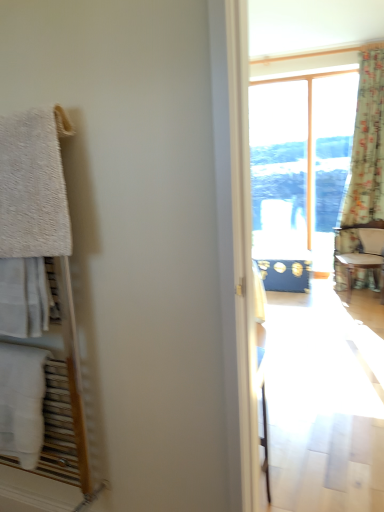
This screenshot has width=384, height=512. What do you see at coordinates (33, 185) in the screenshot?
I see `white fluffy towel at left, placed as the 2th towel/napkin when sorted from bottom to top` at bounding box center [33, 185].

Image resolution: width=384 pixels, height=512 pixels. What do you see at coordinates (353, 253) in the screenshot?
I see `wooden textured chair at right` at bounding box center [353, 253].

You are a GUI agent. You are given a task and a screenshot of the screen. Output one action in this format:
    pyautogui.click(x=<x>, y=<y>)
    Task: Click on the white cotton towel at left, the first towel/napkin when ordered from bottom to top
    The height and width of the screenshot is (512, 384).
    Given the screenshot: What is the action you would take?
    pyautogui.click(x=22, y=402)

Identify the location of white fluffy towel at left, placed as the first towel/napkin when sorted from top to bottom. The width and height of the screenshot is (384, 512). (33, 185).

Where is `curtain behind the white fluffy towel at left, placed as the first towel/napkin when sorted from top to bottom`? This screenshot has width=384, height=512. curtain behind the white fluffy towel at left, placed as the first towel/napkin when sorted from top to bottom is located at coordinates (367, 147).

Is point (364, 166) positioned before point (33, 144)?

No, it is not.

From a real-world perspective, which is physically above, floral fabric curtain at right or white fluffy towel at left, placed as the 2th towel/napkin when sorted from bottom to top?

Answer: From a 3D spatial view, white fluffy towel at left, placed as the 2th towel/napkin when sorted from bottom to top, is above.

Looking at this image, does floral fabric curtain at right have a larger size compared to white fluffy towel at left, placed as the first towel/napkin when sorted from top to bottom?

Yes, floral fabric curtain at right is bigger than white fluffy towel at left, placed as the first towel/napkin when sorted from top to bottom.

From a real-world perspective, is white fluffy towel at left, placed as the first towel/napkin when sorted from top to bottom, physically above white cotton towel at left, the second towel/napkin when ordered from top to bottom?

Yes, from a real-world perspective, white fluffy towel at left, placed as the first towel/napkin when sorted from top to bottom, is over white cotton towel at left, the second towel/napkin when ordered from top to bottom

The width and height of the screenshot is (384, 512). I want to click on towel/napkin located on the right of white cotton towel at left, the second towel/napkin when ordered from top to bottom, so click(33, 185).

What's the angular difference between white fluffy towel at left, placed as the first towel/napkin when sorted from top to bottom, and white cotton towel at left, the first towel/napkin when ordered from bottom to top,'s facing directions?

They differ by 0.000374 degrees in their facing directions.

From the image's perspective, relative to white cotton towel at left, the first towel/napkin when ordered from bottom to top, is white fluffy towel at left, placed as the first towel/napkin when sorted from top to bottom, above or below?

white fluffy towel at left, placed as the first towel/napkin when sorted from top to bottom, is situated higher than white cotton towel at left, the first towel/napkin when ordered from bottom to top, in the image.

Is point (42, 436) closer to camera compared to point (17, 173)?

No, it is not.

Does white cotton towel at left, the first towel/napkin when ordered from bottom to top, touch white fluffy towel at left, placed as the first towel/napkin when sorted from top to bottom?

No, white cotton towel at left, the first towel/napkin when ordered from bottom to top, is not in contact with white fluffy towel at left, placed as the first towel/napkin when sorted from top to bottom.

Which object is positioned more to the left, white cotton towel at left, the second towel/napkin when ordered from top to bottom, or white fluffy towel at left, placed as the 2th towel/napkin when sorted from bottom to top?

From the viewer's perspective, white cotton towel at left, the second towel/napkin when ordered from top to bottom, appears more on the left side.

Looking at this image, considering the relative sizes of white cotton towel at left, the first towel/napkin when ordered from bottom to top, and white fluffy towel at left, placed as the 2th towel/napkin when sorted from bottom to top, in the image provided, is white cotton towel at left, the first towel/napkin when ordered from bottom to top, thinner than white fluffy towel at left, placed as the 2th towel/napkin when sorted from bottom to top,?

Incorrect, the width of white cotton towel at left, the first towel/napkin when ordered from bottom to top, is not less than that of white fluffy towel at left, placed as the 2th towel/napkin when sorted from bottom to top.

Consider the image. Between white cotton towel at left, the first towel/napkin when ordered from bottom to top, and wooden textured chair at right, which one appears on the right side from the viewer's perspective?

wooden textured chair at right is more to the right.

Is white cotton towel at left, the first towel/napkin when ordered from bottom to top, inside the boundaries of wooden textured chair at right, or outside?

white cotton towel at left, the first towel/napkin when ordered from bottom to top, exists outside the volume of wooden textured chair at right.

In the scene shown: In terms of width, does white cotton towel at left, the first towel/napkin when ordered from bottom to top, look wider or thinner when compared to wooden textured chair at right?

Considering their sizes, white cotton towel at left, the first towel/napkin when ordered from bottom to top, looks slimmer than wooden textured chair at right.

Considering the relative positions of white cotton towel at left, the first towel/napkin when ordered from bottom to top, and wooden textured chair at right in the image provided, is white cotton towel at left, the first towel/napkin when ordered from bottom to top, in front of wooden textured chair at right?

Yes.

Could you tell me if white fluffy towel at left, placed as the first towel/napkin when sorted from top to bottom, is facing wooden textured chair at right?

No, white fluffy towel at left, placed as the first towel/napkin when sorted from top to bottom, is not facing towards wooden textured chair at right.

How far apart are white fluffy towel at left, placed as the first towel/napkin when sorted from top to bottom, and wooden textured chair at right?

white fluffy towel at left, placed as the first towel/napkin when sorted from top to bottom, is 3.49 meters away from wooden textured chair at right.

Does white fluffy towel at left, placed as the first towel/napkin when sorted from top to bottom, have a lesser height compared to wooden textured chair at right?

Correct, white fluffy towel at left, placed as the first towel/napkin when sorted from top to bottom, is not as tall as wooden textured chair at right.

Is white fluffy towel at left, placed as the first towel/napkin when sorted from top to bottom, beside wooden textured chair at right?

white fluffy towel at left, placed as the first towel/napkin when sorted from top to bottom, and wooden textured chair at right are clearly separated.

From a real-world perspective, which object stands above the other?

white fluffy towel at left, placed as the 2th towel/napkin when sorted from bottom to top, from a real-world perspective.

Is point (372, 228) positioned behind point (54, 181)?

Yes.

Based on the photo, from a real-world perspective, between white fluffy towel at left, placed as the 2th towel/napkin when sorted from bottom to top, and floral fabric curtain at right, who is vertically lower?

In real-world perspective, floral fabric curtain at right is lower.

Is white fluffy towel at left, placed as the first towel/napkin when sorted from top to bottom, taller than floral fabric curtain at right?

Incorrect, the height of white fluffy towel at left, placed as the first towel/napkin when sorted from top to bottom, is not larger of that of floral fabric curtain at right.

Is white fluffy towel at left, placed as the first towel/napkin when sorted from top to bottom, facing away from floral fabric curtain at right?

Yes, floral fabric curtain at right is at the back of white fluffy towel at left, placed as the first towel/napkin when sorted from top to bottom.

Can you tell me how much white fluffy towel at left, placed as the 2th towel/napkin when sorted from bottom to top, and floral fabric curtain at right differ in facing direction?

The angle between the facing direction of white fluffy towel at left, placed as the 2th towel/napkin when sorted from bottom to top, and the facing direction of floral fabric curtain at right is 3.15 degrees.

At what (x,y) coordinates should I click in order to perform the action: click on curtain on the right of the white fluffy towel at left, placed as the first towel/napkin when sorted from top to bottom. Please return your answer as a coordinate pair (x, y). Image resolution: width=384 pixels, height=512 pixels. Looking at the image, I should click on tap(367, 147).

Image resolution: width=384 pixels, height=512 pixels. Identify the location of towel/napkin behind the white fluffy towel at left, placed as the 2th towel/napkin when sorted from bottom to top. (22, 402).

Estimate the real-world distances between objects in this image. Which object is further from white fluffy towel at left, placed as the 2th towel/napkin when sorted from bottom to top, white cotton towel at left, the first towel/napkin when ordered from bottom to top, or wooden textured chair at right?

Based on the image, wooden textured chair at right appears to be further to white fluffy towel at left, placed as the 2th towel/napkin when sorted from bottom to top.

Looking at this image, estimate the real-world distances between objects in this image. Which object is further from floral fabric curtain at right, wooden textured chair at right or white cotton towel at left, the first towel/napkin when ordered from bottom to top?

white cotton towel at left, the first towel/napkin when ordered from bottom to top, is further to floral fabric curtain at right.

Looking at the image, which one is located closer to wooden textured chair at right, white cotton towel at left, the second towel/napkin when ordered from top to bottom, or white fluffy towel at left, placed as the 2th towel/napkin when sorted from bottom to top?

Among the two, white cotton towel at left, the second towel/napkin when ordered from top to bottom, is located nearer to wooden textured chair at right.

When comparing their distances from floral fabric curtain at right, does white cotton towel at left, the second towel/napkin when ordered from top to bottom, or white fluffy towel at left, placed as the 2th towel/napkin when sorted from bottom to top, seem closer?

white fluffy towel at left, placed as the 2th towel/napkin when sorted from bottom to top, lies closer to floral fabric curtain at right than the other object.

Considering their positions, is floral fabric curtain at right positioned further to wooden textured chair at right than white fluffy towel at left, placed as the first towel/napkin when sorted from top to bottom?

white fluffy towel at left, placed as the first towel/napkin when sorted from top to bottom.

Considering their positions, is floral fabric curtain at right positioned closer to white fluffy towel at left, placed as the first towel/napkin when sorted from top to bottom, than white cotton towel at left, the second towel/napkin when ordered from top to bottom?

Based on the image, white cotton towel at left, the second towel/napkin when ordered from top to bottom, appears to be nearer to white fluffy towel at left, placed as the first towel/napkin when sorted from top to bottom.

Which object lies further to the anchor point floral fabric curtain at right, wooden textured chair at right or white fluffy towel at left, placed as the first towel/napkin when sorted from top to bottom?

Based on the image, white fluffy towel at left, placed as the first towel/napkin when sorted from top to bottom, appears to be further to floral fabric curtain at right.

Looking at the image, which one is located further to white cotton towel at left, the second towel/napkin when ordered from top to bottom, white fluffy towel at left, placed as the 2th towel/napkin when sorted from bottom to top, or wooden textured chair at right?

Based on the image, wooden textured chair at right appears to be further to white cotton towel at left, the second towel/napkin when ordered from top to bottom.

I want to click on towel/napkin between white fluffy towel at left, placed as the 2th towel/napkin when sorted from bottom to top, and floral fabric curtain at right from front to back, so pyautogui.click(x=22, y=402).

Locate an element on the screen. The height and width of the screenshot is (512, 384). towel/napkin between white fluffy towel at left, placed as the first towel/napkin when sorted from top to bottom, and wooden textured chair at right from front to back is located at coordinates (22, 402).

Where is `chair positioned between white fluffy towel at left, placed as the 2th towel/napkin when sorted from bottom to top, and floral fabric curtain at right from near to far`? The image size is (384, 512). chair positioned between white fluffy towel at left, placed as the 2th towel/napkin when sorted from bottom to top, and floral fabric curtain at right from near to far is located at coordinates (353, 253).

The width and height of the screenshot is (384, 512). I want to click on chair between white cotton towel at left, the second towel/napkin when ordered from top to bottom, and floral fabric curtain at right in the front-back direction, so click(x=353, y=253).